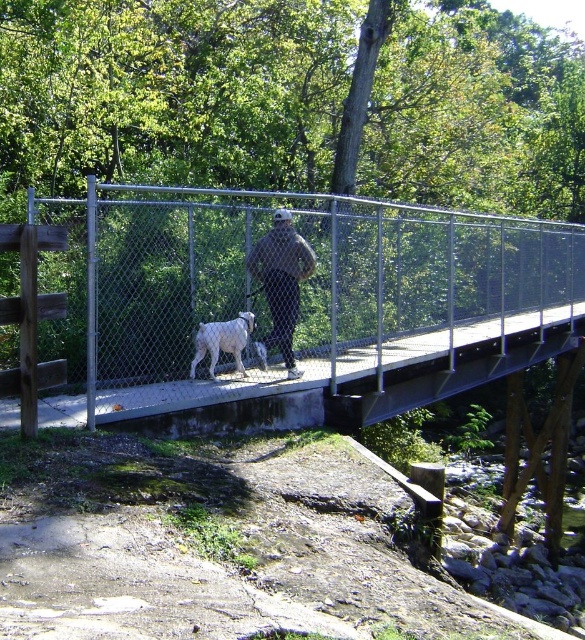
You are standing on the metal pedestrian bridge and notice the dark gray fabric jacket at center. Based on its position, can you determine if the jacket is closer to the left or right side of the bridge?

The dark gray fabric jacket at center is located at point 0.480 on the horizontal axis, which places it near the center of the bridge. Since the jacket is at the center, it is equidistant from both the left and right sides of the bridge.